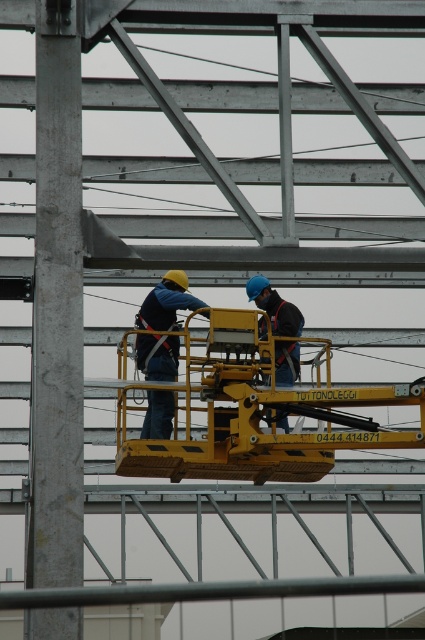
Does point (275, 456) come closer to viewer compared to point (282, 376)?

Yes, it is in front of point (282, 376).

Is yellow metallic lift at center taller than blue hard hat at center?

In fact, yellow metallic lift at center may be shorter than blue hard hat at center.

What are the coordinates of `yellow metallic lift at center` in the screenshot? It's located at (257, 412).

Locate an element on the screen. The image size is (425, 640). yellow metallic lift at center is located at coordinates (257, 412).

From the picture: Which is below, matte blue safety vest at center or blue hard hat at center?

matte blue safety vest at center

Measure the distance from matte blue safety vest at center to blue hard hat at center.

They are 1.62 meters apart.

You are a GUI agent. You are given a task and a screenshot of the screen. Output one action in this format:
    pyautogui.click(x=<x>, y=<y>)
    Task: Click on the matte blue safety vest at center
    The height and width of the screenshot is (640, 425).
    Given the screenshot: What is the action you would take?
    pyautogui.click(x=167, y=301)

In the scene shown: Which is above, yellow metallic lift at center or matte blue safety vest at center?

matte blue safety vest at center is above.

Consider the image. Does yellow metallic lift at center have a greater width compared to matte blue safety vest at center?

In fact, yellow metallic lift at center might be narrower than matte blue safety vest at center.

Find the location of a particular element. Image resolution: width=425 pixels, height=640 pixels. yellow metallic lift at center is located at coordinates (257, 412).